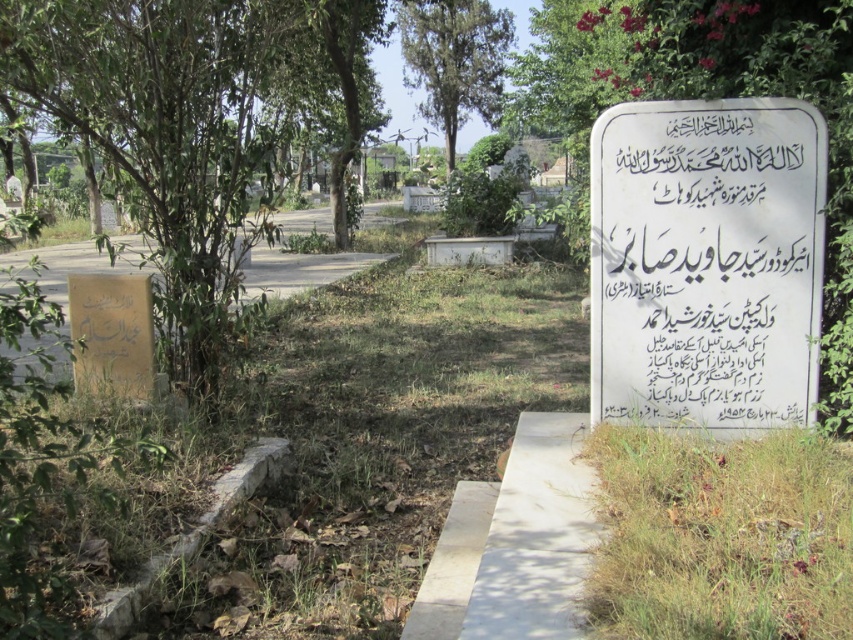
You are standing at the entrance of the cemetery and see two points marked in the image. The first point is at coordinates point (740, 536) and the second point is at point (57, 244). Which point is closer to you?

Point (740, 536) is in front of point (57, 244), so the first point is closer to you.

You are a visitor at the cemetery and want to place a small bouquet between the white paper sign at upper right and the green leafy tree at upper center. Based on their sizes, will the bouquet fit comfortably between them?

The white paper sign at upper right has a lesser width compared to green leafy tree at upper center, so the space between them should be sufficient to place the bouquet comfortably.